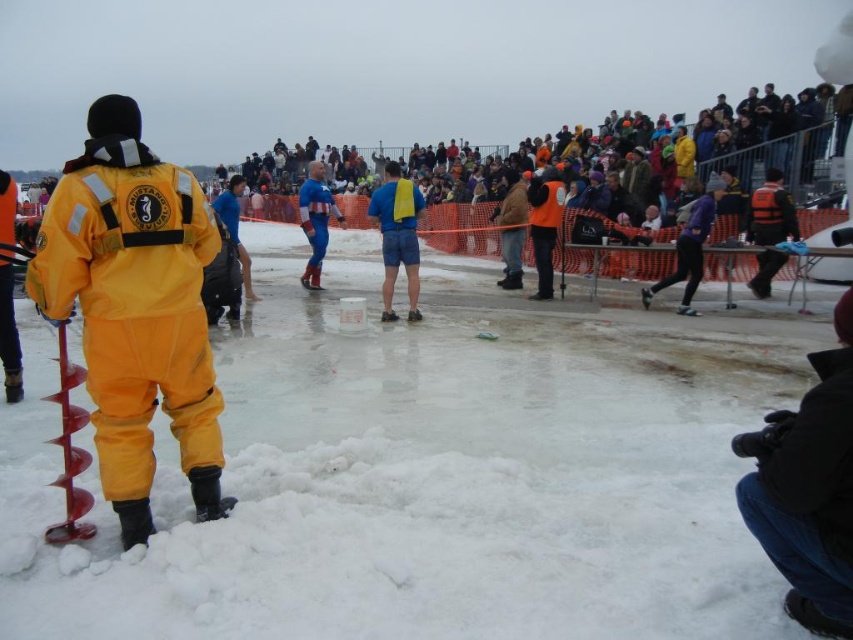
Based on the photo, is white fluffy snow at lower left to the left of purple fabric pants at center from the viewer's perspective?

Correct, you'll find white fluffy snow at lower left to the left of purple fabric pants at center.

Is white fluffy snow at lower left further to camera compared to purple fabric pants at center?

No, it is in front of purple fabric pants at center.

Between point (422, 595) and point (686, 259), which one is positioned in front?

Point (422, 595)

Identify the location of white fluffy snow at lower left. Image resolution: width=853 pixels, height=640 pixels. (431, 472).

Is point (76, 257) farther from camera compared to point (672, 276)?

That is False.

Between matte yellow snowsuit at left and purple fabric pants at center, which one is positioned lower?

matte yellow snowsuit at left

You are a GUI agent. You are given a task and a screenshot of the screen. Output one action in this format:
    pyautogui.click(x=<x>, y=<y>)
    Task: Click on the matte yellow snowsuit at left
    The width and height of the screenshot is (853, 640).
    Given the screenshot: What is the action you would take?
    pyautogui.click(x=135, y=308)

Does matte yellow snowsuit at left have a greater height compared to blue fabric shorts at center?

No.

Is matte yellow snowsuit at left shorter than blue fabric shorts at center?

Indeed, matte yellow snowsuit at left has a lesser height compared to blue fabric shorts at center.

Is point (213, 384) more distant than point (410, 220)?

No, (213, 384) is closer to viewer.

The width and height of the screenshot is (853, 640). I want to click on matte yellow snowsuit at left, so click(135, 308).